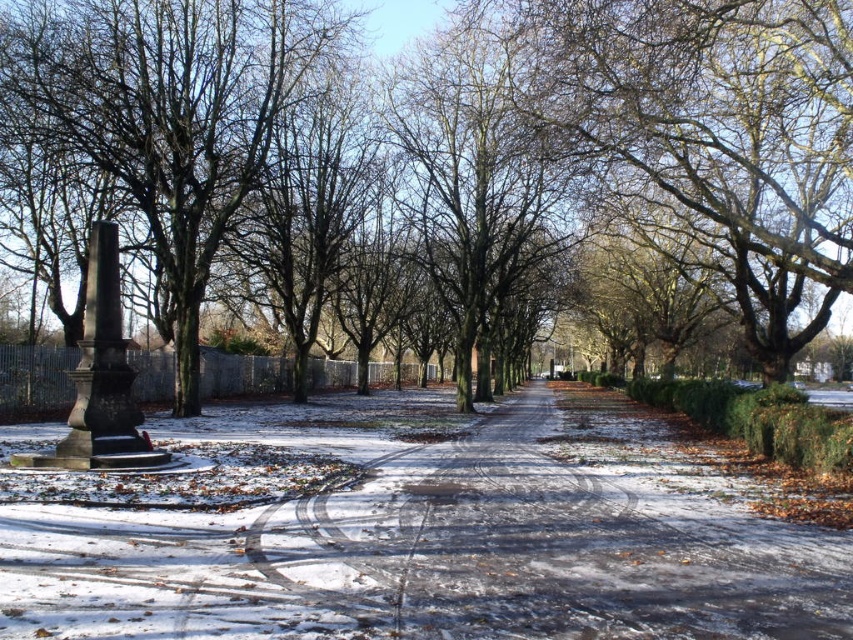
You are an artist planning to paint the winter scene. You want to ensure the proportions between the smooth brown tree at left and the brown textured tree at center are accurate. Which tree should you draw wider in your painting?

The smooth brown tree at left should be drawn wider in the painting since its width is larger than the brown textured tree at center according to the description.

You are standing at the snowy asphalt path at lower left and want to walk towards the monument. Which direction should you look to see the bare branches at center?

The snowy asphalt path at lower left is below the bare branches at center, so you should look upward to see the bare branches at center.